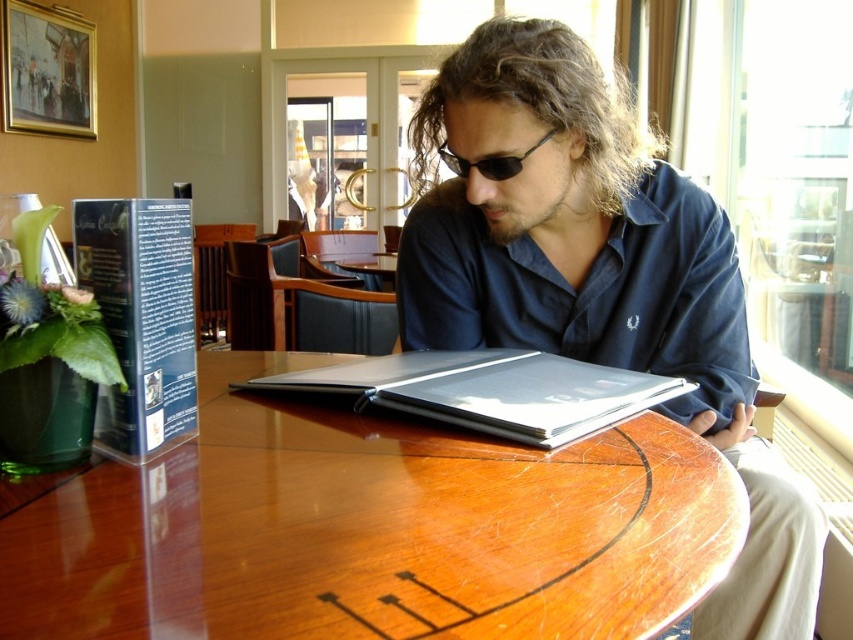
You are the man sitting at the table in the image. You want to place your phone on the table between the two points labeled point (292, 525) and point (532, 148). Based on their positions, which point should you place your phone closer to so it stays between them?

You should place your phone closer to point (532, 148) because point (292, 525) is in front of point (532, 148). This means the phone should be positioned nearer to the point that is farther back to stay between them.

You are a waiter in a restaurant and need to place a small plate between the shiny wood table at center and the sunglasses at center. Which object should you move to make space?

The shiny wood table at center is wider than the sunglasses at center, so you should move the sunglasses at center to make space for the plate.

You are a waiter in a restaurant. You need to place a new menu on the table. The menu is 12 inches tall. The space between the shiny wood table at center and sunglasses at center is 10 inches. Can you fit the menu vertically between them?

The shiny wood table at center is much taller than the sunglasses at center. The space between them is 10 inches, which is less than the 12 inch height of the menu. Therefore, the menu cannot be placed vertically between the shiny wood table at center and sunglasses at center.